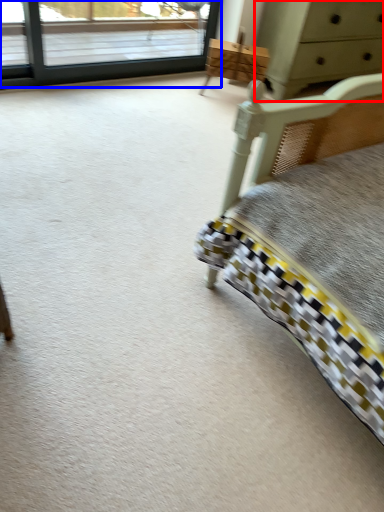
Question: Which object is closer to the camera taking this photo, chest of drawers (highlighted by a red box) or window (highlighted by a blue box)?

Choices:
 (A) chest of drawers
 (B) window

Answer: (B)